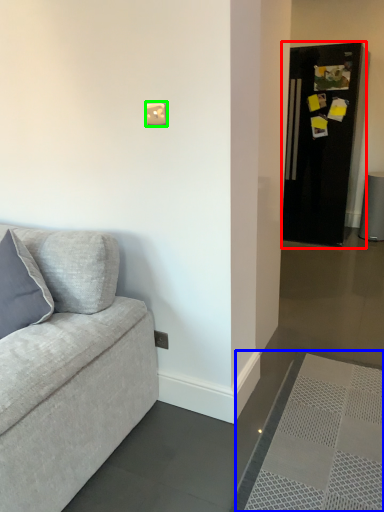
Question: Considering the real-world distances, which object is farthest from fridge (highlighted by a red box)? doormat (highlighted by a blue box) or light switch (highlighted by a green box)?

Choices:
 (A) doormat
 (B) light switch

Answer: (B)